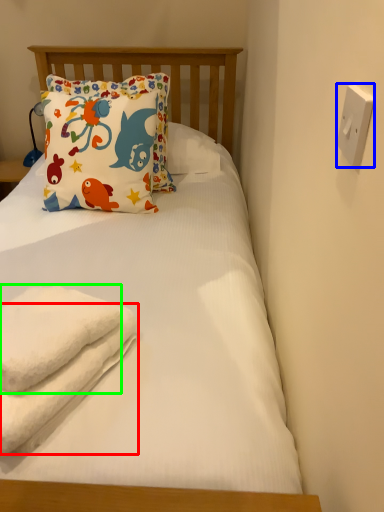
Question: Which is farther away from beach towel (highlighted by a red box)? electric outlet (highlighted by a blue box) or towel (highlighted by a green box)?

Choices:
 (A) electric outlet
 (B) towel

Answer: (A)